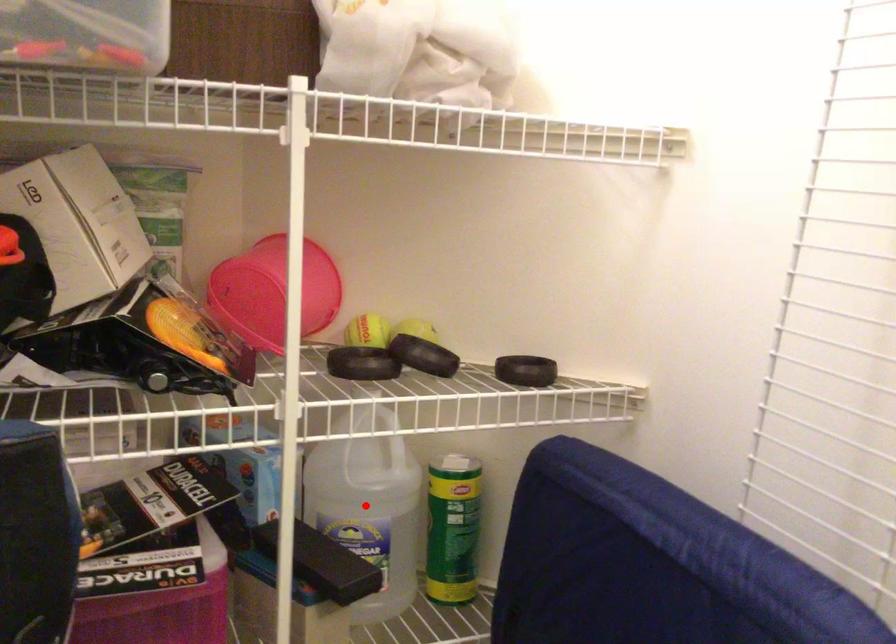
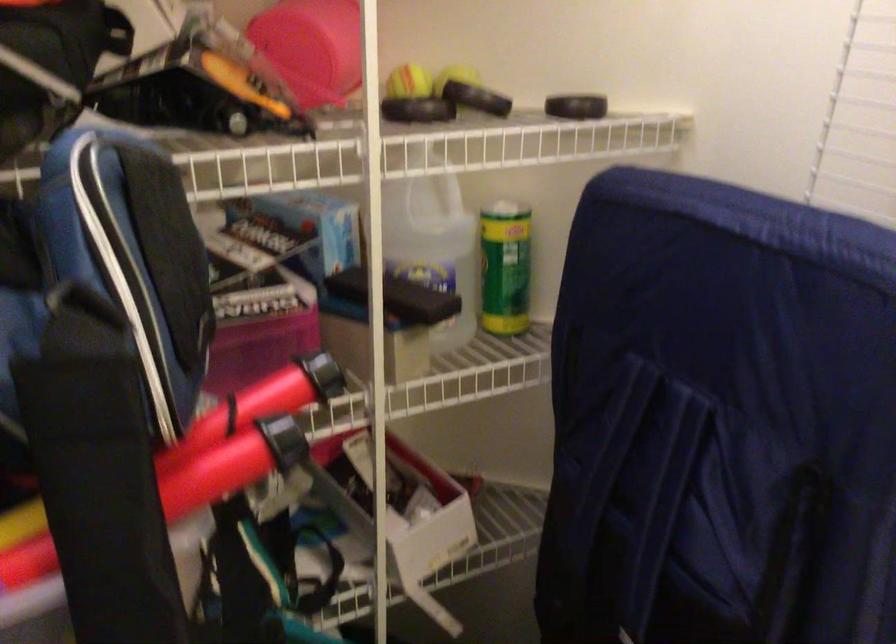
In the second image, find the point that corresponds to the highlighted location in the first image.

(433, 243)